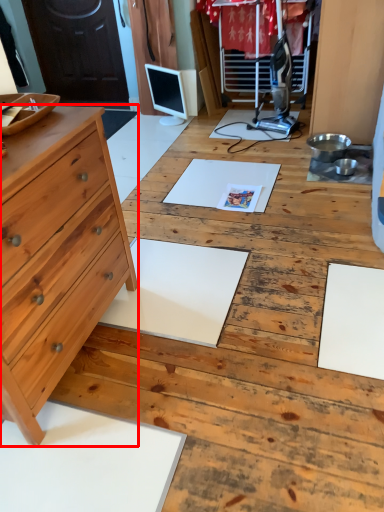
Question: Where is chest of drawers (annotated by the red box) located in relation to computer monitor in the image?

Choices:
 (A) left
 (B) right

Answer: (A)